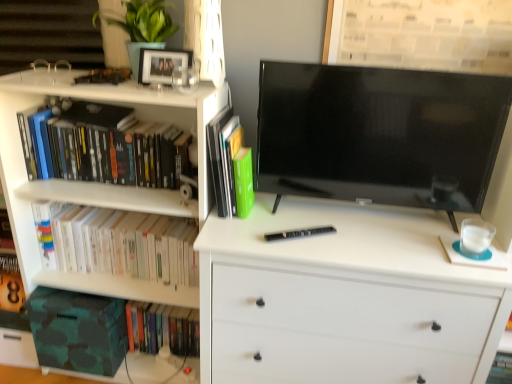
The width and height of the screenshot is (512, 384). I want to click on vacant point to the right of green matte book at center, which is counted as the 2th book, starting from the top, so click(280, 213).